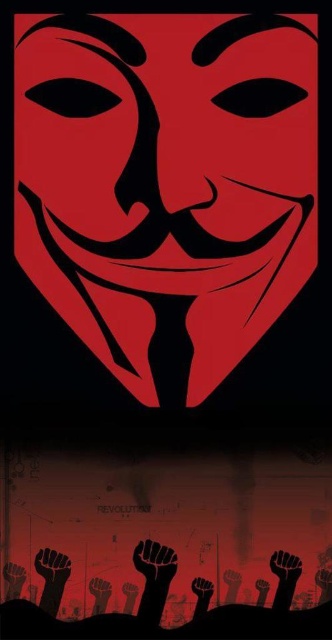
Question: Observing the image, what is the correct spatial positioning of black matte fist at lower center in reference to black matte hand at lower center?

Choices:
 (A) left
 (B) right

Answer: (A)

Question: Which of the following is the closest to the observer?

Choices:
 (A) matte red mask at center
 (B) black matte hand at lower center
 (C) black matte fist at lower center

Answer: (A)

Question: Can you confirm if matte red mask at center is positioned above black matte fist at lower center?

Choices:
 (A) yes
 (B) no

Answer: (A)

Question: Is matte red mask at center wider than black matte hand at lower center?

Choices:
 (A) yes
 (B) no

Answer: (A)

Question: Which object is the farthest from the black matte fist at lower center?

Choices:
 (A) black matte hand at lower center
 (B) matte red mask at center

Answer: (B)

Question: Which object is the farthest from the black matte fist at lower center?

Choices:
 (A) black matte hand at lower center
 (B) matte red mask at center

Answer: (B)